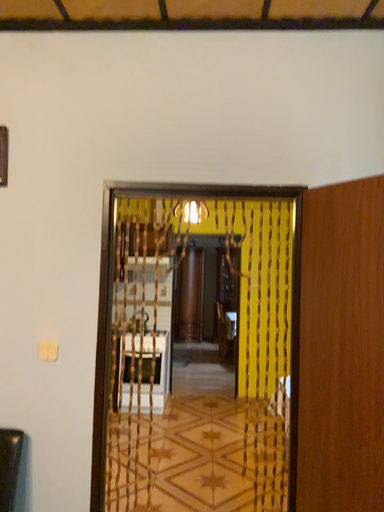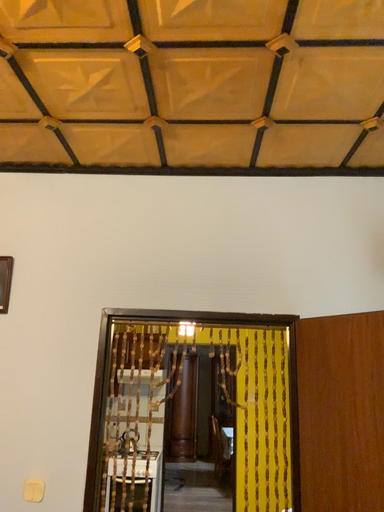
Question: How did the camera likely rotate when shooting the video?

Choices:
 (A) rotated downward
 (B) rotated upward

Answer: (B)